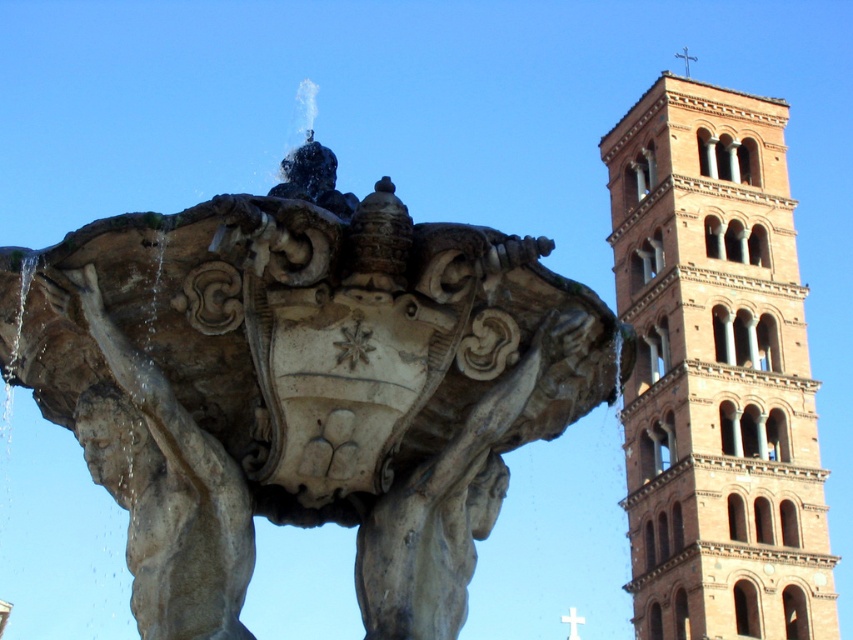
You are standing in front of the stone fountain at center and want to take a photo of the terracotta brick tower at right. Which object should you focus on first to ensure both are in the frame?

You should focus on the stone fountain at center first because it is closer to you than the terracotta brick tower at right, so adjusting focus starting from the closer object ensures both are in the frame.

You are standing at the entrance of the historic tower and want to find the stone fountain at center. According to the coordinates provided, in which direction should you move relative to the tower to locate it?

The stone fountain at center is located at coordinates point (303,385). Since the x coordinate is greater than 0.5, it means the fountain is to the right of the tower. Move to the right side of the tower to find it.

Consider the image. You are standing at the point with coordinates (303, 385) in the image. Based on the scene described, what object are you directly facing?

The point at coordinates (303, 385) corresponds to the stone fountain at center, so you are directly facing the stone fountain at center.